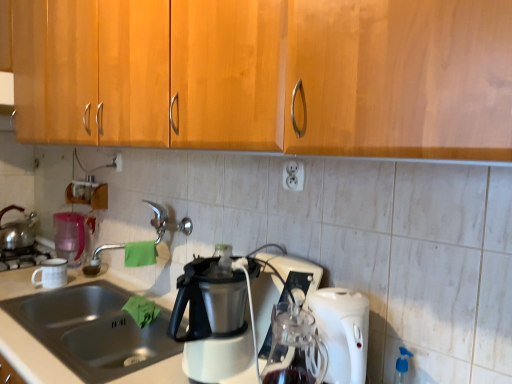
Question: Does white plastic electric outlet at center, positioned as the first electric outlet in right-to-left order, appear on the left side of stainless steel sink at lower left?

Choices:
 (A) no
 (B) yes

Answer: (A)

Question: Is white plastic electric outlet at center, the 2th electric outlet in the back-to-front sequence, not close to stainless steel sink at lower left?

Choices:
 (A) yes
 (B) no

Answer: (B)

Question: Is white plastic electric outlet at center, which is the first electric outlet from front to back, aimed at stainless steel sink at lower left?

Choices:
 (A) yes
 (B) no

Answer: (B)

Question: Is stainless steel sink at lower left located within white plastic electric outlet at center, the second electric outlet positioned from the left?

Choices:
 (A) no
 (B) yes

Answer: (A)

Question: From a real-world perspective, is white plastic electric outlet at center, positioned as the first electric outlet in right-to-left order, below stainless steel sink at lower left?

Choices:
 (A) no
 (B) yes

Answer: (A)

Question: Is white plastic electric outlet at center, the second electric outlet positioned from the left, not inside stainless steel sink at lower left?

Choices:
 (A) no
 (B) yes

Answer: (B)

Question: From the image's perspective, is pink plastic pitcher at left under white matte coffee cup at left?

Choices:
 (A) yes
 (B) no

Answer: (B)

Question: Is pink plastic pitcher at left at the left side of white matte coffee cup at left?

Choices:
 (A) yes
 (B) no

Answer: (A)

Question: Is pink plastic pitcher at left positioned far away from white matte coffee cup at left?

Choices:
 (A) yes
 (B) no

Answer: (B)

Question: Is white matte coffee cup at left located within pink plastic pitcher at left?

Choices:
 (A) yes
 (B) no

Answer: (B)

Question: From a real-world perspective, is pink plastic pitcher at left physically below white matte coffee cup at left?

Choices:
 (A) no
 (B) yes

Answer: (A)

Question: Considering the relative sizes of pink plastic pitcher at left and white matte coffee cup at left in the image provided, is pink plastic pitcher at left taller than white matte coffee cup at left?

Choices:
 (A) no
 (B) yes

Answer: (B)

Question: Is shiny metallic kettle at left positioned with its back to white matte coffee cup at left?

Choices:
 (A) no
 (B) yes

Answer: (A)